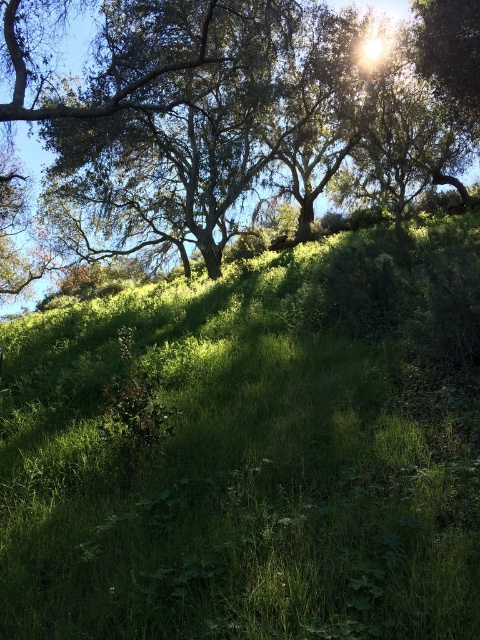
Question: Is green grassy hillside at upper center thinner than green leafy tree at upper left?

Choices:
 (A) no
 (B) yes

Answer: (B)

Question: Is the position of green grassy hillside at upper center less distant than that of green leafy tree at upper left?

Choices:
 (A) yes
 (B) no

Answer: (A)

Question: Which of the following is the farthest from the observer?

Choices:
 (A) green leafy tree at upper left
 (B) green grassy hillside at upper center

Answer: (A)

Question: Does green grassy hillside at upper center come behind green leafy tree at upper left?

Choices:
 (A) no
 (B) yes

Answer: (A)

Question: Which point appears closest to the camera in this image?

Choices:
 (A) (409, 602)
 (B) (31, 138)

Answer: (A)